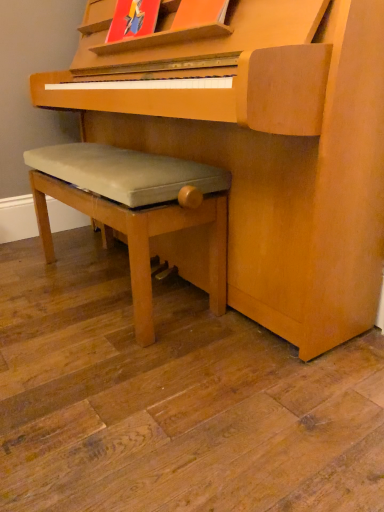
This screenshot has height=512, width=384. In order to click on light gray fabric bench at lower left in this screenshot , I will do `click(142, 214)`.

What do you see at coordinates (142, 214) in the screenshot? I see `light gray fabric bench at lower left` at bounding box center [142, 214].

Where is `light gray fabric bench at lower left`? The width and height of the screenshot is (384, 512). light gray fabric bench at lower left is located at coordinates (142, 214).